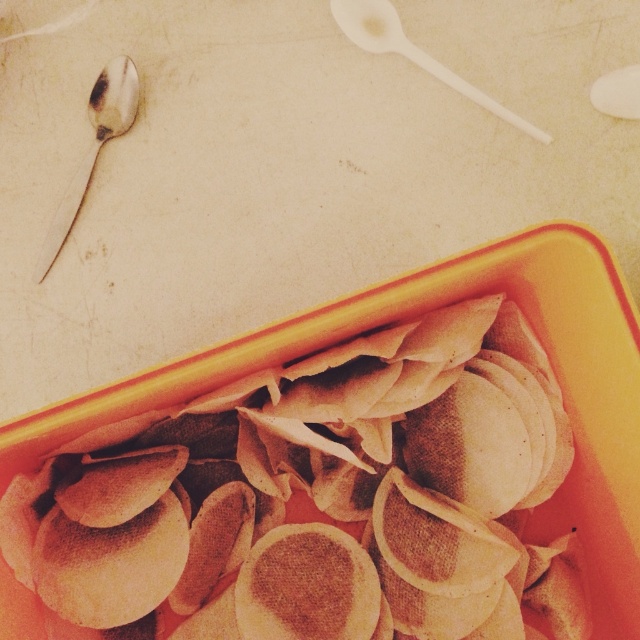
You are at a buffet and need to choose between the shiny silver spoon at upper left and the white plastic spoon at upper center to serve yourself. The distance between them is important because you want to pick the closer one to save time. Which spoon should you choose?

The shiny silver spoon at upper left is 32.03 centimeters away from the white plastic spoon at upper center. Since you want the closer one, you should choose whichever is nearer. However, the description only provides the distance between them, not their positions relative to your current location. Without knowing where you are standing, it is impossible to determine which is closer to you.

You are a food delivery person who needs to pick up the container with brown matte dumplings at center. The container is on a table that is 36 inches high. Can you reach the dumplings without standing on something?

The brown matte dumplings at center and camera are 34.22 inches apart from each other. Since the table is 36 inches high, you would need to reach up approximately 36 inches to the table top. The distance from the camera to the dumplings is horizontal, not vertical, so this does not indicate whether you can reach the height. You may need to check your own height or use a tool to reach the 36 inch height.